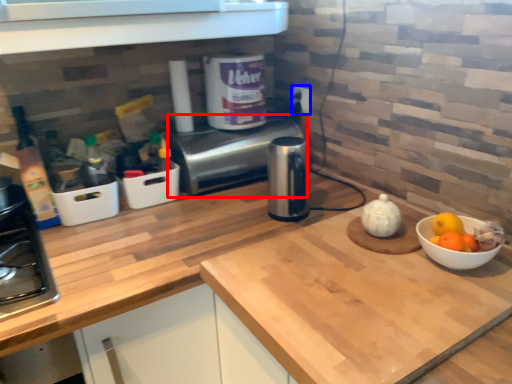
Question: Which object is closer to the camera taking this photo, oven (highlighted by a red box) or electric outlet (highlighted by a blue box)?

Choices:
 (A) oven
 (B) electric outlet

Answer: (A)